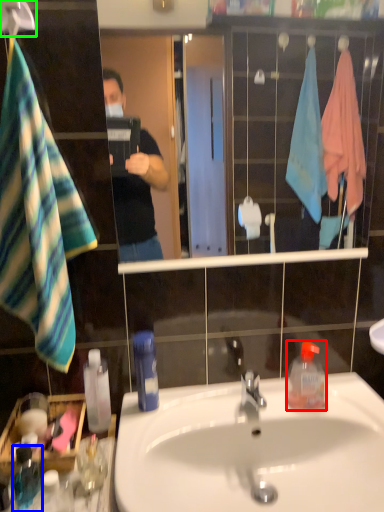
Question: Which object is the farthest from bottle (highlighted by a red box)? Choose among these: bottle (highlighted by a blue box) or hanger (highlighted by a green box).

Choices:
 (A) bottle
 (B) hanger

Answer: (B)